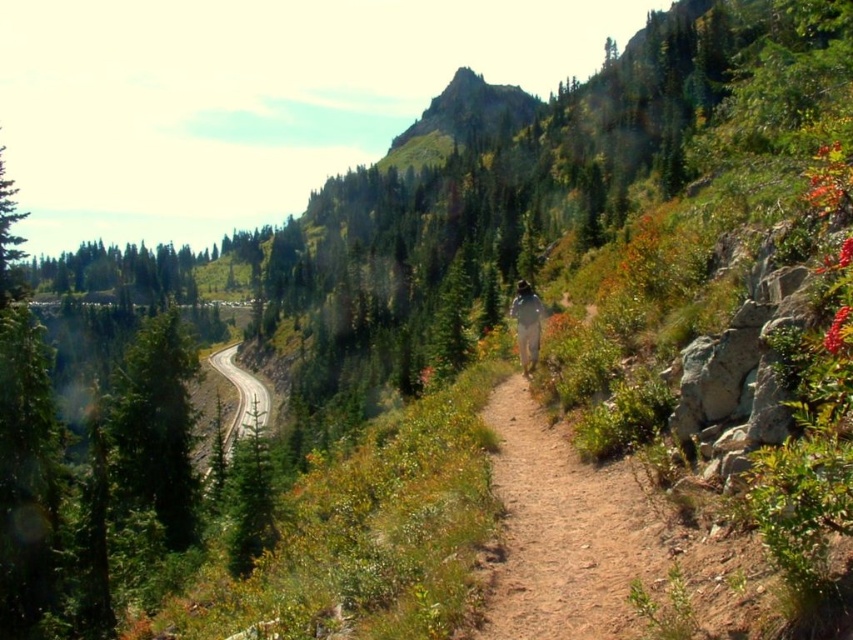
Does smooth asphalt road at left have a greater width compared to white fabric at center?

Correct, the width of smooth asphalt road at left exceeds that of white fabric at center.

Does smooth asphalt road at left have a greater height compared to white fabric at center?

Correct, smooth asphalt road at left is much taller as white fabric at center.

I want to click on smooth asphalt road at left, so click(235, 417).

Identify the location of smooth asphalt road at left. (235, 417).